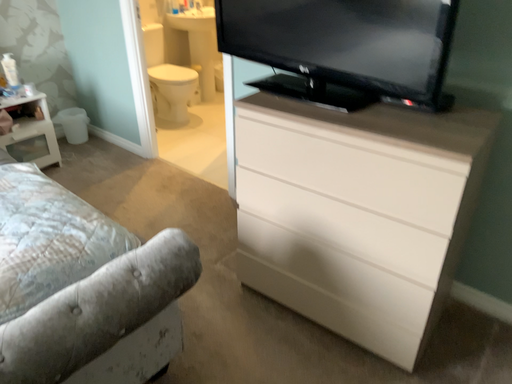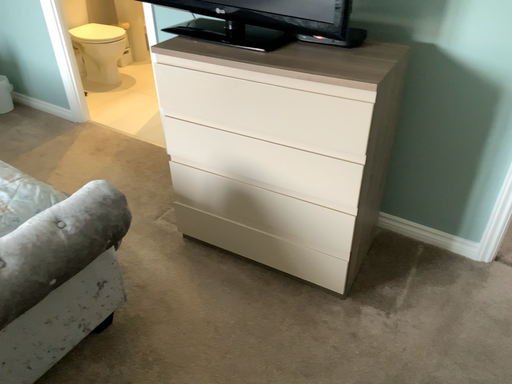
Question: Which way did the camera rotate in the video?

Choices:
 (A) rotated left
 (B) rotated right

Answer: (B)